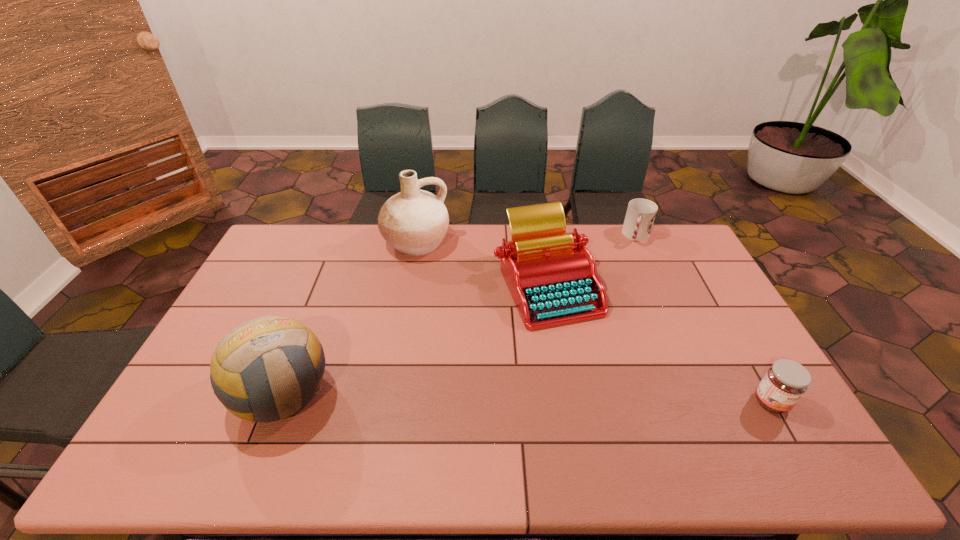
Locate an element on the screen. This screenshot has width=960, height=540. vacant space that satisfies the following two spatial constraints: 1. on the front side of the typewriter; 2. on the left side of the tallest object is located at coordinates (408, 285).